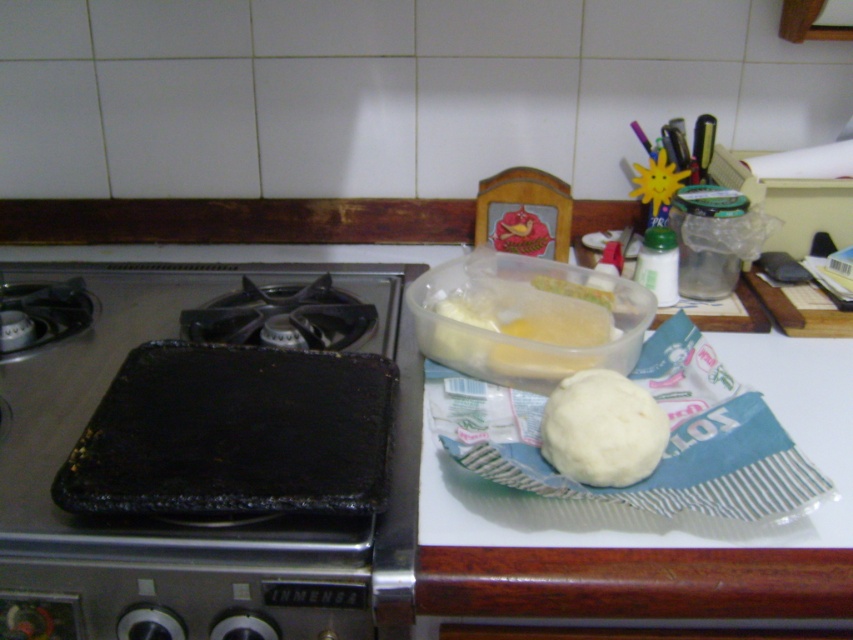
Which is behind, point (33, 563) or point (480, 320)?

The point (480, 320) is more distant.

Between black non-stick griddle at center and translucent plastic container at center, which one has less height?

translucent plastic container at center is shorter.

Between point (33, 490) and point (589, 328), which one is positioned in front?

Positioned in front is point (33, 490).

Locate an element on the screen. This screenshot has height=640, width=853. black non-stick griddle at center is located at coordinates click(x=193, y=516).

Which is below, translucent plastic container at center or white matte dough at center?

white matte dough at center

Is point (469, 333) closer to camera compared to point (563, 388)?

That is False.

Does point (496, 346) lie in front of point (648, 474)?

No, (496, 346) is behind (648, 474).

Identify the location of translucent plastic container at center. (515, 330).

Looking at this image, does black non-stick griddle at center have a smaller size compared to white matte dough at center?

Incorrect, black non-stick griddle at center is not smaller in size than white matte dough at center.

Is point (300, 634) in front of point (625, 378)?

Yes, it is in front of point (625, 378).

Does point (25, 589) come closer to viewer compared to point (554, 442)?

That is True.

Locate an element on the screen. black non-stick griddle at center is located at coordinates (193, 516).